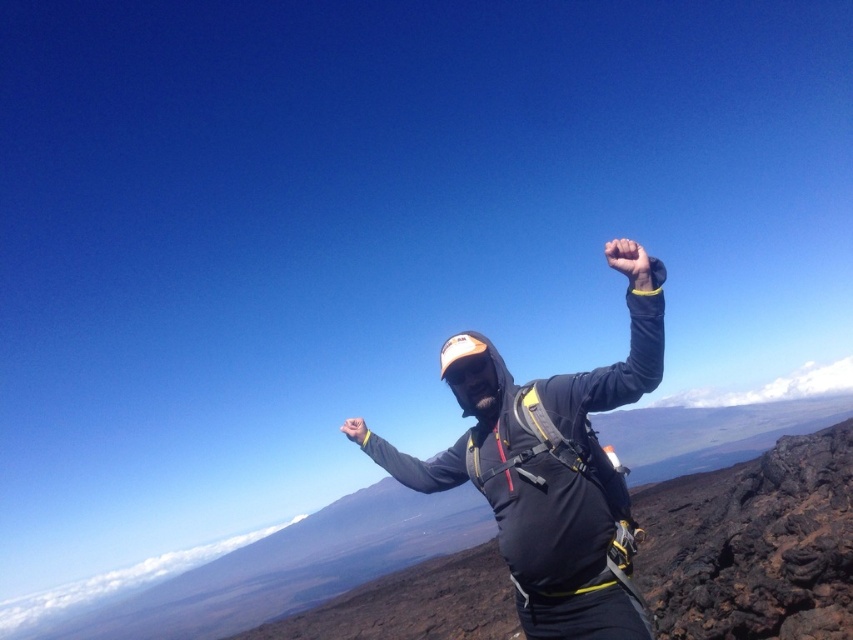
Question: Among these points, which one is nearest to the camera?

Choices:
 (A) (463, 452)
 (B) (346, 422)
 (C) (578, 568)

Answer: (C)

Question: Considering the relative positions of black fleece arm at center and yellow matte hand at upper center in the image provided, where is black fleece arm at center located with respect to yellow matte hand at upper center?

Choices:
 (A) above
 (B) below

Answer: (B)

Question: Does black fabric jacket at center appear on the right side of black fleece arm at center?

Choices:
 (A) yes
 (B) no

Answer: (B)

Question: Among these points, which one is nearest to the camera?

Choices:
 (A) (619, 244)
 (B) (309, 636)
 (C) (544, 580)

Answer: (A)

Question: Does black fleece arm at center appear under yellow matte hand at upper center?

Choices:
 (A) no
 (B) yes

Answer: (B)

Question: Among these objects, which one is farthest from the camera?

Choices:
 (A) black fleece arm at center
 (B) black matte jacket at center
 (C) yellow matte hand at upper center
 (D) black fabric jacket at center

Answer: (D)